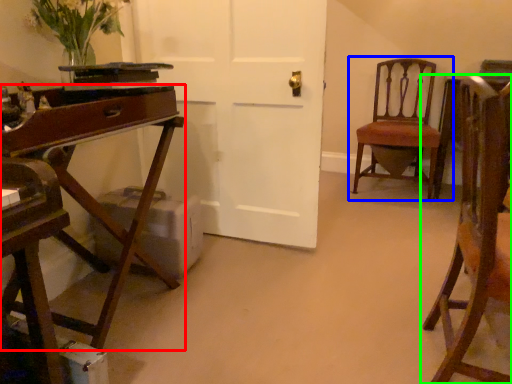
Question: Estimate the real-world distances between objects in this image. Which object is closer to desk (highlighted by a red box), chair (highlighted by a blue box) or chair (highlighted by a green box)?

Choices:
 (A) chair
 (B) chair

Answer: (B)